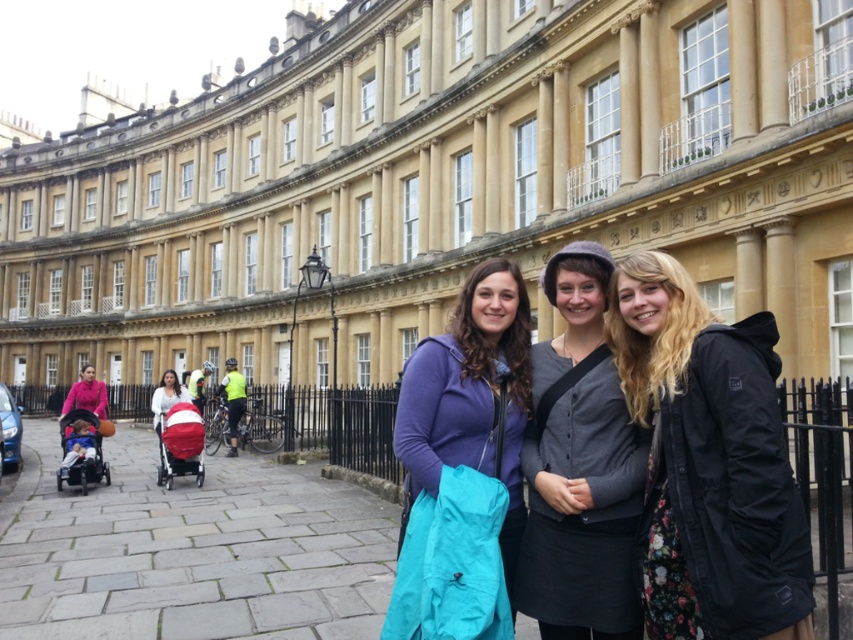
Question: Is black matte jacket at center to the left of matte white stroller at left from the viewer's perspective?

Choices:
 (A) yes
 (B) no

Answer: (B)

Question: Can you confirm if matte purple jacket at center is positioned above matte red baby carriage at lower left?

Choices:
 (A) yes
 (B) no

Answer: (A)

Question: Which point is closer to the camera taking this photo?

Choices:
 (A) (660, 312)
 (B) (187, 426)
 (C) (601, 512)
 (D) (157, 428)

Answer: (C)

Question: Based on their relative distances, which object is farther from the matte white stroller at left?

Choices:
 (A) red fabric baby carriage at left
 (B) gray matte cardigan at center
 (C) matte red baby carriage at lower left

Answer: (B)

Question: Among these objects, which one is farthest from the camera?

Choices:
 (A) red fabric baby carriage at left
 (B) black matte jacket at center
 (C) matte white stroller at left
 (D) matte red baby carriage at lower left

Answer: (C)

Question: Does black matte jacket at center appear over red fabric baby carriage at left?

Choices:
 (A) no
 (B) yes

Answer: (B)